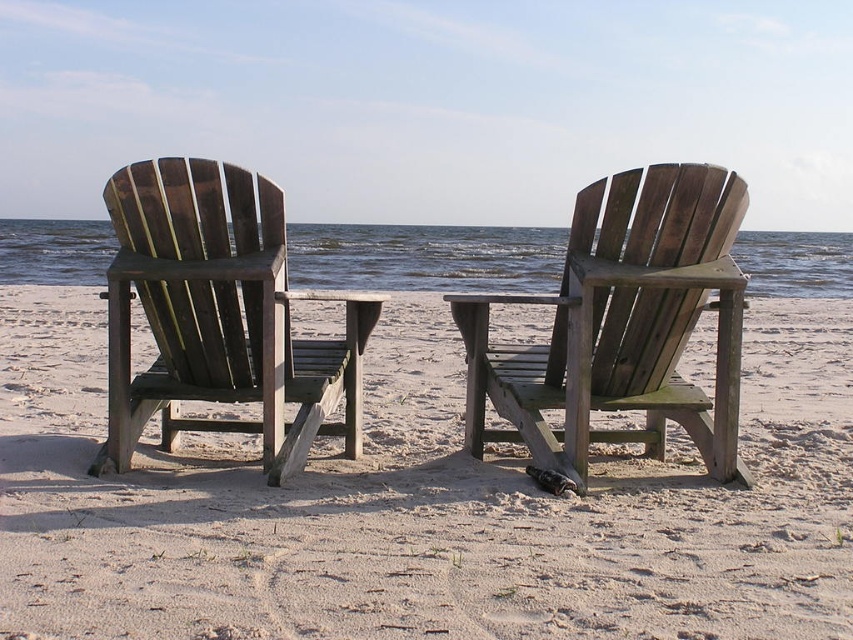
Which of these two, wooden beach chair at center or dark brown wood beach chair at left, stands taller?

With more height is dark brown wood beach chair at left.

Which of these two, wooden beach chair at center or dark brown wood beach chair at left, stands shorter?

wooden beach chair at center is shorter.

In order to click on wooden beach chair at center in this screenshot , I will do `click(621, 324)`.

At what (x,y) coordinates should I click in order to perform the action: click on wooden beach chair at center. Please return your answer as a coordinate pair (x, y). The image size is (853, 640). Looking at the image, I should click on (621, 324).

Is weathered wood chairs at center thinner than dark brown wood beach chair at left?

In fact, weathered wood chairs at center might be wider than dark brown wood beach chair at left.

Does point (352, 467) come farther from viewer compared to point (158, 403)?

Yes, point (352, 467) is farther from viewer.

Locate an element on the screen. weathered wood chairs at center is located at coordinates (421, 506).

Is weathered wood chairs at center thinner than wooden beach chair at center?

No.

Is point (30, 616) positioned in front of point (469, 294)?

Yes, it is in front of point (469, 294).

The width and height of the screenshot is (853, 640). I want to click on weathered wood chairs at center, so (421, 506).